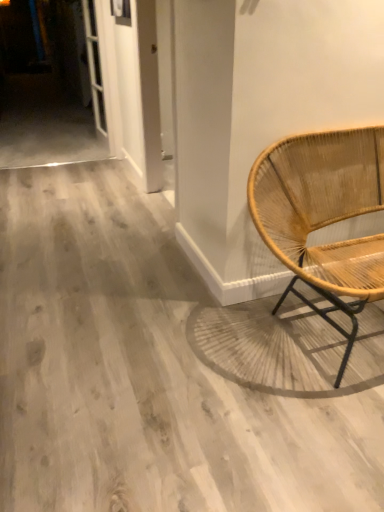
Measure the distance between point (x=334, y=298) and camera.

They are 1.56 meters apart.

Describe the element at coordinates (323, 216) in the screenshot. I see `brown wicker chair at right` at that location.

In order to face brown wicker chair at right, should I rotate leftwards or rightwards?

A 21.724 degree turn to the right will do.

You are a GUI agent. You are given a task and a screenshot of the screen. Output one action in this format:
    pyautogui.click(x=<x>, y=<y>)
    Task: Click on the brown wicker chair at right
    The width and height of the screenshot is (384, 512).
    Given the screenshot: What is the action you would take?
    pyautogui.click(x=323, y=216)

Identify the location of brown wicker chair at right. (323, 216).